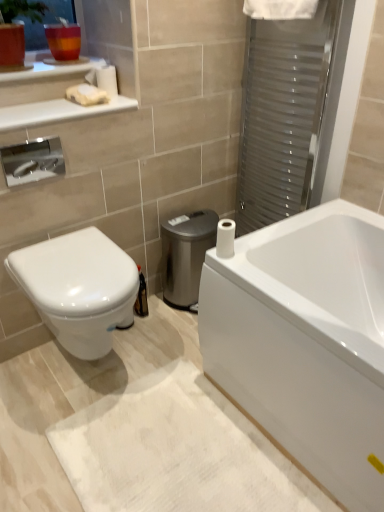
In order to face metallic silver water heater at center, should I rotate leftwards or rightwards?

Rotate your view right by about 0.041°.

What is the approximate width of white matte toilet paper at lower right, which ranks as the 1th toilet paper in bottom-to-top order?

2.67 inches.

Consider the image. What is the approximate width of white glossy bathtub at lower right?

28.58 inches.

Describe the element at coordinates (47, 22) in the screenshot. The width and height of the screenshot is (384, 512). I see `translucent glass cup at upper left` at that location.

You are a GUI agent. You are given a task and a screenshot of the screen. Output one action in this format:
    pyautogui.click(x=<x>, y=<y>)
    Task: Click on the metallic silver water heater at center
    
    Given the screenshot: What is the action you would take?
    pyautogui.click(x=186, y=255)

From a real-world perspective, who is located lower, white glossy bathtub at lower right or translucent glass cup at upper left?

From a 3D spatial view, white glossy bathtub at lower right is below.

Between white glossy bathtub at lower right and translucent glass cup at upper left, which one has less height?

With less height is translucent glass cup at upper left.

Considering the relative sizes of white glossy bathtub at lower right and translucent glass cup at upper left in the image provided, is white glossy bathtub at lower right wider than translucent glass cup at upper left?

Indeed, white glossy bathtub at lower right has a greater width compared to translucent glass cup at upper left.

Would you say white glossy bathtub at lower right is a long distance from translucent glass cup at upper left?

Yes, white glossy bathtub at lower right and translucent glass cup at upper left are quite far apart.

In the image, is metallic silver water heater at center positioned in front of or behind white glossy toilet at lower left?

Visually, metallic silver water heater at center is located behind white glossy toilet at lower left.

How different are the orientations of metallic silver water heater at center and white glossy toilet at lower left in degrees?

0.77 degrees separate the facing orientations of metallic silver water heater at center and white glossy toilet at lower left.

From the picture: Could you tell me if metallic silver water heater at center is turned towards white glossy toilet at lower left?

No, metallic silver water heater at center is not oriented towards white glossy toilet at lower left.

Which of these two, metallic silver water heater at center or white glossy toilet at lower left, stands taller?

metallic silver water heater at center.

Would you say translucent glass cup at upper left is to the left or to the right of white matte toilet paper at upper left, acting as the 2th toilet paper starting from the bottom, in the picture?

Clearly, translucent glass cup at upper left is on the left of white matte toilet paper at upper left, acting as the 2th toilet paper starting from the bottom, in the image.

Is translucent glass cup at upper left located outside white matte toilet paper at upper left, placed as the second toilet paper when sorted from right to left?

That's correct, translucent glass cup at upper left is outside of white matte toilet paper at upper left, placed as the second toilet paper when sorted from right to left.

How many degrees apart are the facing directions of translucent glass cup at upper left and white matte toilet paper at upper left, which is the 1th toilet paper in top-to-bottom order?

The facing directions of translucent glass cup at upper left and white matte toilet paper at upper left, which is the 1th toilet paper in top-to-bottom order, are 0.0808 degrees apart.

From the image's perspective, relative to metallic silver water heater at center, is translucent glass cup at upper left above or below?

Based on their image positions, translucent glass cup at upper left is located above metallic silver water heater at center.

From a real-world perspective, which is physically above, translucent glass cup at upper left or metallic silver water heater at center?

translucent glass cup at upper left.

Who is smaller, translucent glass cup at upper left or metallic silver water heater at center?

translucent glass cup at upper left.

Which is behind, point (29, 49) or point (214, 225)?

The point (214, 225) is farther.

Find the location of `toilet lying above the white soft bath mat at lower center (from the image's perspective)`. toilet lying above the white soft bath mat at lower center (from the image's perspective) is located at coordinates (78, 288).

Can you confirm if white soft bath mat at lower center is positioned to the right of white glossy toilet at lower left?

Indeed, white soft bath mat at lower center is positioned on the right side of white glossy toilet at lower left.

Can we say white soft bath mat at lower center lies outside white glossy toilet at lower left?

white soft bath mat at lower center lies outside white glossy toilet at lower left's area.

From a real-world perspective, does white glossy toilet at lower left stand above metallic silver water heater at center?

Yes, from a real-world perspective, white glossy toilet at lower left is above metallic silver water heater at center.

At what (x,y) coordinates should I click in order to perform the action: click on water heater that is behind the white glossy toilet at lower left. Please return your answer as a coordinate pair (x, y). Looking at the image, I should click on (186, 255).

Considering the relative sizes of white glossy toilet at lower left and metallic silver water heater at center in the image provided, is white glossy toilet at lower left bigger than metallic silver water heater at center?

Yes.

Which object is positioned more to the right, white glossy toilet at lower left or metallic silver water heater at center?

metallic silver water heater at center.

Is white matte toilet paper at lower right, placed as the first toilet paper when sorted from front to back, located outside translucent glass cup at upper left?

Yes.

Does white matte toilet paper at lower right, which ranks as the 1th toilet paper in bottom-to-top order, come behind translucent glass cup at upper left?

No, white matte toilet paper at lower right, which ranks as the 1th toilet paper in bottom-to-top order, is closer to the camera.

How many degrees apart are the facing directions of white matte toilet paper at lower right, which is the second toilet paper from left to right, and translucent glass cup at upper left?

92.4 degrees.

Considering the positions of point (227, 255) and point (28, 34), is point (227, 255) closer or farther from the camera than point (28, 34)?

Point (227, 255) appears to be closer to the viewer than point (28, 34).

Locate an element on the screen. Image resolution: width=384 pixels, height=512 pixels. bathtub in front of the translucent glass cup at upper left is located at coordinates (306, 341).

Image resolution: width=384 pixels, height=512 pixels. I want to click on toilet that is above the metallic silver water heater at center (from a real-world perspective), so click(x=78, y=288).

Which object lies nearer to the anchor point white glossy bathtub at lower right, metallic silver water heater at center or transparent plastic screen door at upper right?

metallic silver water heater at center.

Consider the image. Based on their spatial positions, is white matte soap at upper left or white glossy toilet at lower left further from transparent plastic screen door at upper right?

white glossy toilet at lower left.

When comparing their distances from white glossy toilet at lower left, does white matte toilet paper at lower right, which ranks as the 2th toilet paper in top-to-bottom order, or translucent glass cup at upper left seem closer?

Based on the image, white matte toilet paper at lower right, which ranks as the 2th toilet paper in top-to-bottom order, appears to be nearer to white glossy toilet at lower left.

From the image, which object appears to be farther from white matte toilet paper at lower right, positioned as the 1th toilet paper in right-to-left order, white matte soap at upper left or metallic silver water heater at center?

The object further to white matte toilet paper at lower right, positioned as the 1th toilet paper in right-to-left order, is white matte soap at upper left.

Estimate the real-world distances between objects in this image. Which object is further from white glossy bathtub at lower right, white matte soap at upper left or translucent glass cup at upper left?

translucent glass cup at upper left is further to white glossy bathtub at lower right.

Estimate the real-world distances between objects in this image. Which object is further from metallic silver water heater at center, white glossy toilet at lower left or white soft bath mat at lower center?

white soft bath mat at lower center.

Estimate the real-world distances between objects in this image. Which object is further from white soft bath mat at lower center, white matte toilet paper at upper left, placed as the second toilet paper when sorted from right to left, or white glossy toilet at lower left?

white matte toilet paper at upper left, placed as the second toilet paper when sorted from right to left, lies further to white soft bath mat at lower center than the other object.

Considering their positions, is translucent glass cup at upper left positioned closer to white matte soap at upper left than metallic silver water heater at center?

translucent glass cup at upper left is closer to white matte soap at upper left.

Where is `screen door between translucent glass cup at upper left and white soft bath mat at lower center vertically`? screen door between translucent glass cup at upper left and white soft bath mat at lower center vertically is located at coordinates (281, 114).

Identify the location of bathtub between white matte toilet paper at lower right, placed as the first toilet paper when sorted from front to back, and white soft bath mat at lower center vertically. This screenshot has height=512, width=384. (306, 341).

Find the location of a particular element. Image resolution: width=384 pixels, height=512 pixels. balustrade between white matte toilet paper at upper left, placed as the second toilet paper when sorted from right to left, and white glossy toilet at lower left, in the vertical direction is located at coordinates (57, 112).

Identify the location of screen door between white matte toilet paper at upper left, the first toilet paper when ordered from back to front, and white glossy toilet at lower left vertically. (281, 114).